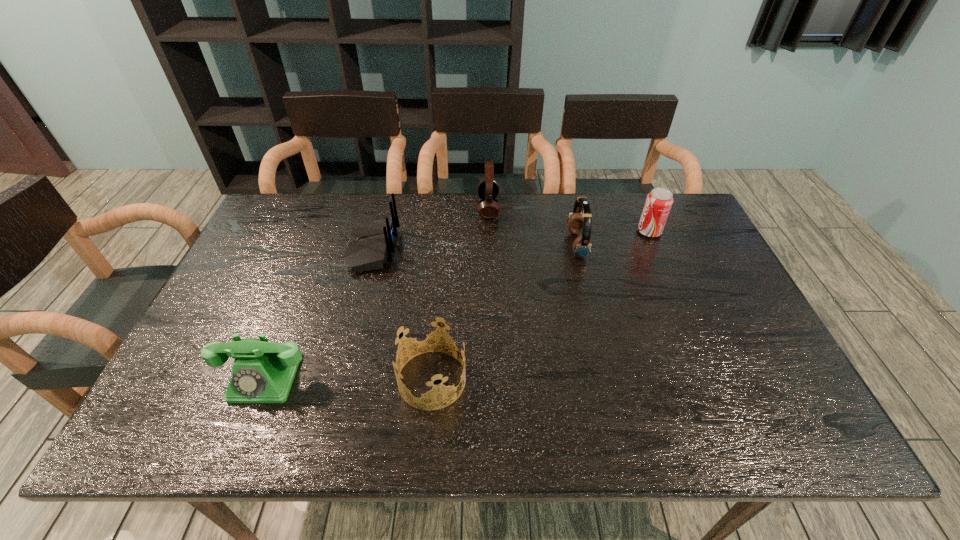
Where is `free space between the router and the nearer headset`? The image size is (960, 540). free space between the router and the nearer headset is located at coordinates (475, 247).

The width and height of the screenshot is (960, 540). What are the coordinates of `free space between the telephone and the nearer headset` in the screenshot? It's located at (421, 311).

The height and width of the screenshot is (540, 960). Find the location of `blank region between the telephone and the router`. blank region between the telephone and the router is located at coordinates (320, 313).

Find the location of a particular element. Image resolution: width=960 pixels, height=540 pixels. empty space that is in between the left headset and the third object from left to right is located at coordinates (460, 294).

Locate an element on the screen. free space between the router and the fourth object from left to right is located at coordinates (431, 228).

I want to click on vacant area that lies between the right headset and the router, so click(475, 247).

You are a GUI agent. You are given a task and a screenshot of the screen. Output one action in this format:
    pyautogui.click(x=<x>, y=<y>)
    Task: Click on the free area in between the crown and the router
    The image size is (960, 540).
    Given the screenshot: What is the action you would take?
    pyautogui.click(x=402, y=314)

Image resolution: width=960 pixels, height=540 pixels. Find the location of `vacant area between the telephone and the soda can`. vacant area between the telephone and the soda can is located at coordinates (457, 305).

Identify the location of empty location between the right headset and the farthest object. (533, 227).

Locate an element on the screen. This screenshot has height=540, width=960. vacant space that is in between the router and the farther headset is located at coordinates (431, 228).